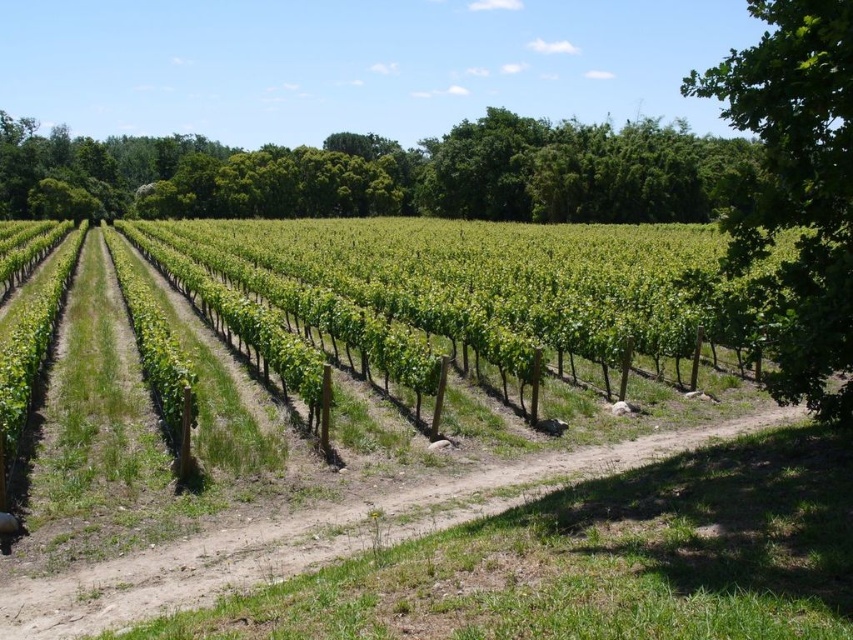
Does point (302, 205) come closer to viewer compared to point (773, 65)?

No, it is behind (773, 65).

Is point (515, 140) more distant than point (822, 182)?

Yes, point (515, 140) is behind point (822, 182).

Which is behind, point (537, 179) or point (849, 13)?

The point (537, 179) is behind.

Locate an element on the screen. This screenshot has width=853, height=640. green leafy tree at upper right is located at coordinates (386, 173).

Does green leafy tree at right appear over dirt path at lower center?

Yes.

Between green leafy tree at right and dirt path at lower center, which one appears on the right side from the viewer's perspective?

green leafy tree at right is more to the right.

Is point (811, 259) closer to camera compared to point (112, 564)?

Yes, point (811, 259) is in front of point (112, 564).

The image size is (853, 640). What are the coordinates of `green leafy tree at right` in the screenshot? It's located at (793, 189).

Describe the element at coordinates (386, 173) in the screenshot. The image size is (853, 640). I see `green leafy tree at upper right` at that location.

Is point (657, 147) positioned after point (434, 499)?

Yes, point (657, 147) is farther from viewer.

You are a GUI agent. You are given a task and a screenshot of the screen. Output one action in this format:
    pyautogui.click(x=<x>, y=<y>)
    Task: Click on the green leafy tree at upper right
    This screenshot has height=640, width=853.
    Given the screenshot: What is the action you would take?
    pyautogui.click(x=386, y=173)